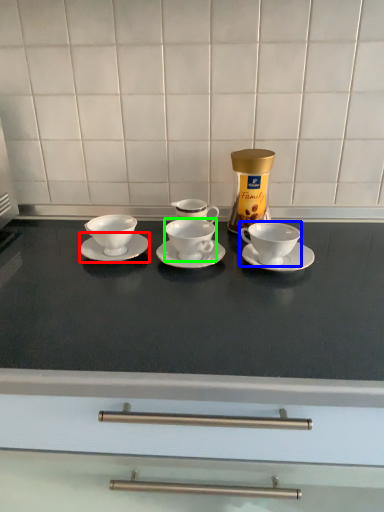
Question: Which is nearer to the saucer (highlighted by a red box)? coffee cup (highlighted by a blue box) or coffee cup (highlighted by a green box).

Choices:
 (A) coffee cup
 (B) coffee cup

Answer: (B)